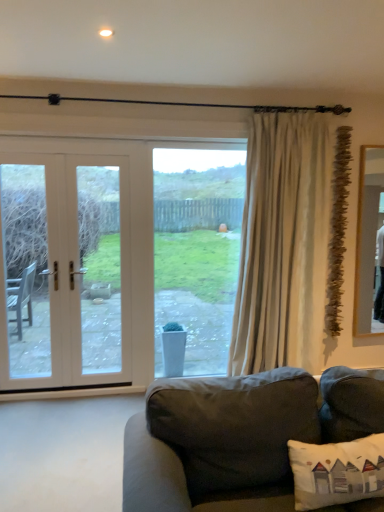
Question: Looking at the image, does dark gray fabric couch at lower center seem bigger or smaller compared to white fabric pillow at lower right?

Choices:
 (A) big
 (B) small

Answer: (A)

Question: Relative to white fabric pillow at lower right, is dark gray fabric couch at lower center in front or behind?

Choices:
 (A) behind
 (B) front

Answer: (B)

Question: Estimate the real-world distances between objects in this image. Which object is farther from the dark gray fabric couch at lower center?

Choices:
 (A) beige fabric curtain at right
 (B) white wood door at left
 (C) white fabric pillow at lower right
 (D) clear glass window at center

Answer: (B)

Question: Estimate the real-world distances between objects in this image. Which object is farther from the white wood door at left?

Choices:
 (A) dark gray fabric couch at lower center
 (B) white fabric pillow at lower right
 (C) clear glass window at center
 (D) beige fabric curtain at right

Answer: (B)